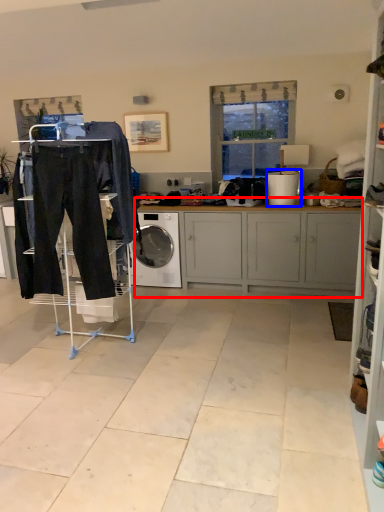
Question: Among these objects, which one is nearest to the camera, cabinetry (highlighted by a red box) or appliance (highlighted by a blue box)?

Choices:
 (A) cabinetry
 (B) appliance

Answer: (A)